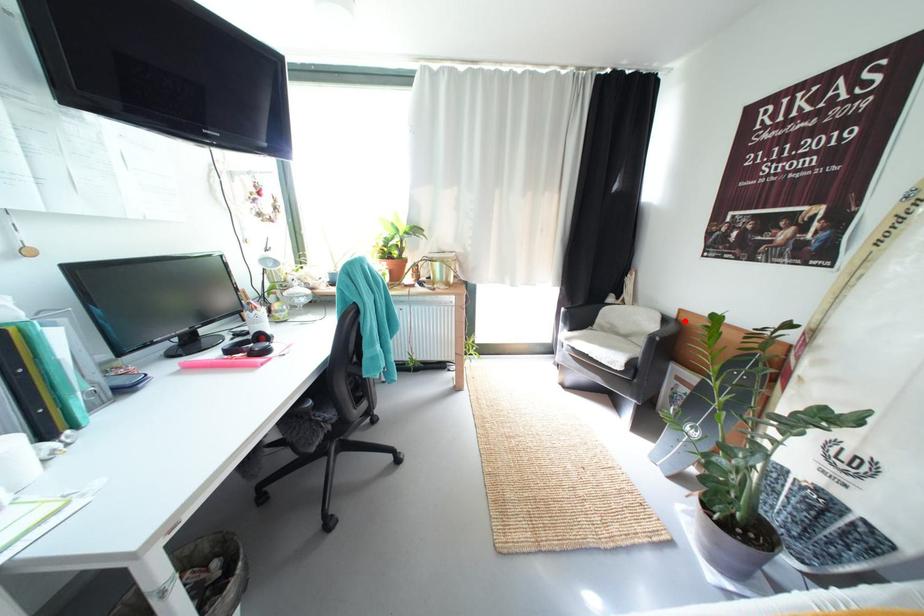
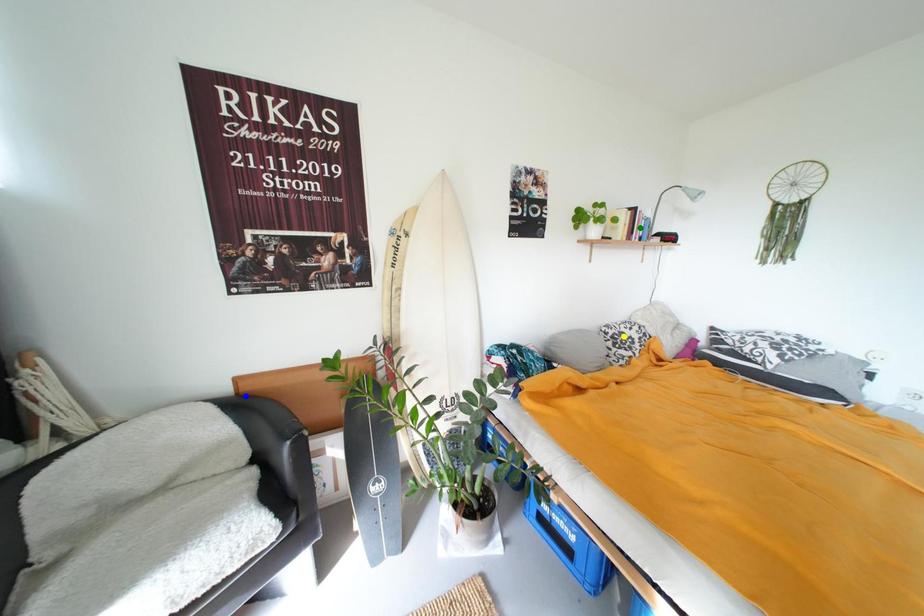
Question: I am providing you with two images of the same scene from different viewpoints. A red point is marked on the first image. You are given multiple points on the second image. Which point in image 2 represents the same 3d spot as the red point in image 1?

Choices:
 (A) green point
 (B) yellow point
 (C) blue point

Answer: (C)